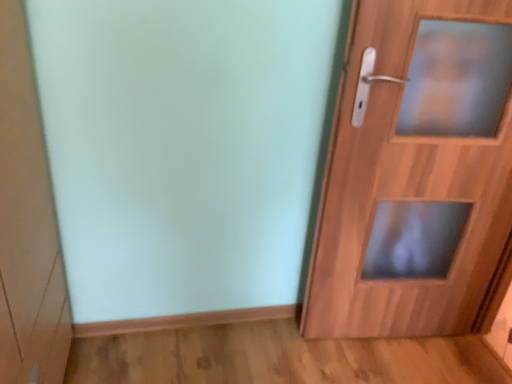
I want to click on free spot in front of wooden door at right, so click(386, 362).